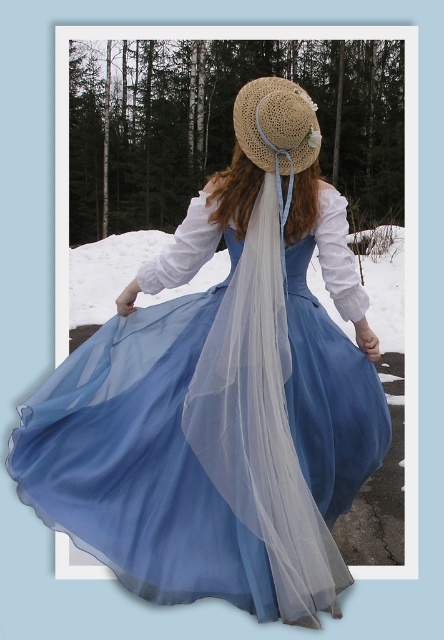
You are standing in a snowy forest and see the light blue chiffon dress at center. If you want to hand a scarf to the person wearing the dress without moving closer, what is the maximum distance you can maintain while still reaching them?

The light blue chiffon dress at center is 2.54 meters away from the viewer. Since you cannot move closer, the maximum distance you can maintain while still reaching them is 2.54 meters.

You are an artist trying to sketch the scene. You need to place the light blue chiffon dress at center in your drawing. According to the coordinates provided, where should you position it?

The light blue chiffon dress at center should be positioned at coordinates point (x=211, y=438).

You are a fashion designer observing a model wearing the light blue chiffon dress at center and the straw hat at center. Which item has a greater width?

The light blue chiffon dress at center has a greater width than the straw hat at center, as stated in the description.